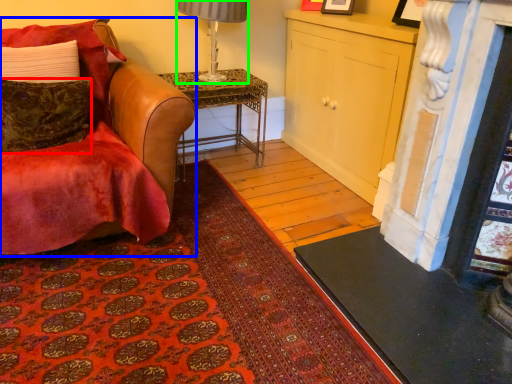
Question: Which is farther away from pillow (highlighted by a red box)? chair (highlighted by a blue box) or lamp (highlighted by a green box)?

Choices:
 (A) chair
 (B) lamp

Answer: (B)